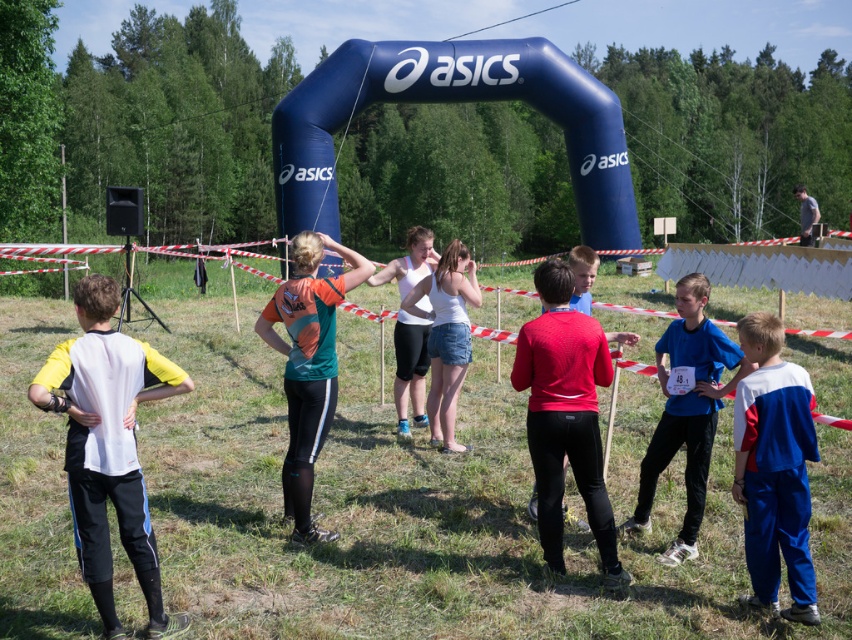
Question: Is matte red sweater at center closer to the viewer compared to orange fabric shirt at center?

Choices:
 (A) no
 (B) yes

Answer: (B)

Question: Which object appears closest to the camera in this image?

Choices:
 (A) orange fabric shirt at center
 (B) blue matte shirt at center

Answer: (B)

Question: Considering the real-world distances, which object is farthest from the orange fabric shirt at center?

Choices:
 (A) matte red sweater at center
 (B) blue track suit at center
 (C) white matte shirt at left
 (D) white matte tank top at center

Answer: (B)

Question: Observing the image, what is the correct spatial positioning of white matte shirt at left in reference to blue track suit at center?

Choices:
 (A) above
 (B) below

Answer: (A)

Question: Which point is closer to the camera?

Choices:
 (A) white matte shirt at left
 (B) matte red sweater at center
 (C) orange fabric shirt at center

Answer: (A)

Question: Can you confirm if matte red sweater at center is thinner than orange fabric shirt at center?

Choices:
 (A) no
 (B) yes

Answer: (B)